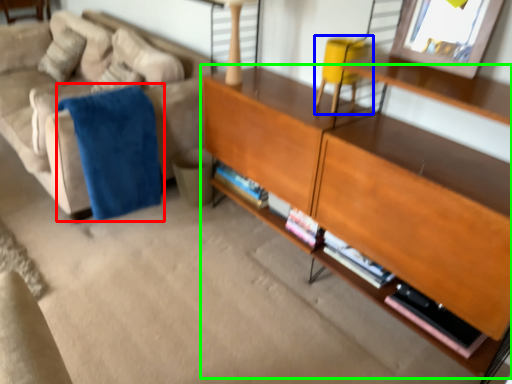
Question: Based on their relative distances, which object is farther from blanket (highlighted by a red box)? Choose from swivel chair (highlighted by a blue box) and shelf (highlighted by a green box).

Choices:
 (A) swivel chair
 (B) shelf

Answer: (A)